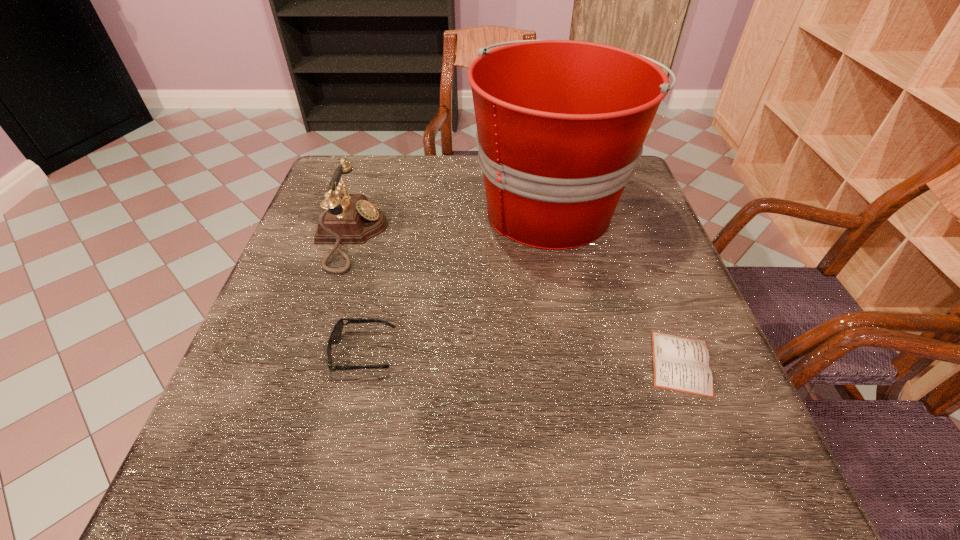
Locate an element on the screen. bucket located at the right edge is located at coordinates (561, 124).

I want to click on diary present at the right edge, so 681,364.

Image resolution: width=960 pixels, height=540 pixels. Identify the location of object positioned at the far right corner. (561, 124).

Identify the location of vacant space at the far edge. The width and height of the screenshot is (960, 540). (451, 199).

Identify the location of free location at the near edge of the desktop. coord(507,504).

Image resolution: width=960 pixels, height=540 pixels. In order to click on vacant space at the left edge of the desktop in this screenshot , I will do `click(307, 253)`.

The image size is (960, 540). What are the coordinates of `blank space at the right edge of the desktop` in the screenshot? It's located at (658, 315).

Where is `free space at the far left corner of the desktop`? The width and height of the screenshot is (960, 540). free space at the far left corner of the desktop is located at coordinates (379, 186).

What are the coordinates of `vacant space at the near left corner` in the screenshot? It's located at (223, 496).

This screenshot has height=540, width=960. Identify the location of free location at the near right corner of the desktop. (708, 456).